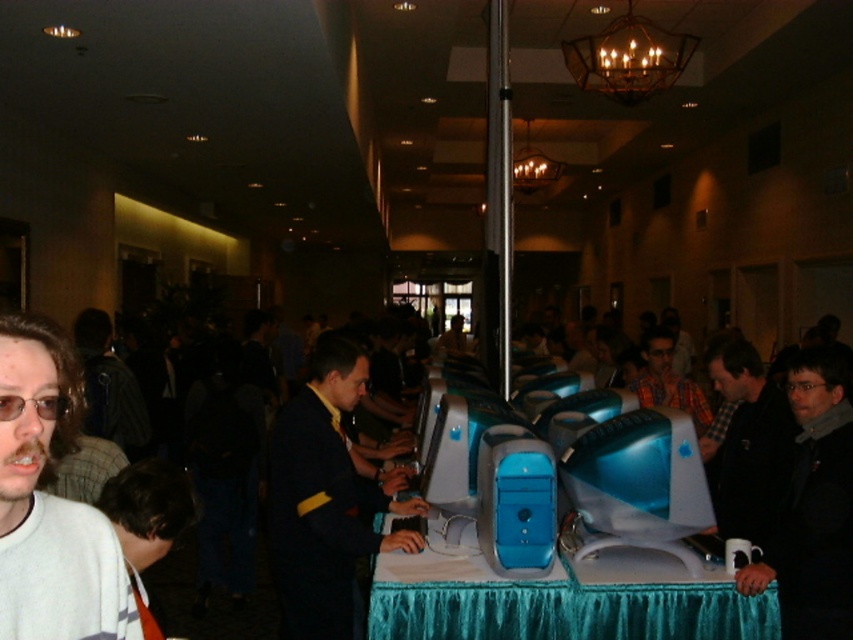
Question: Does blue glossy monitor at center lie in front of black wool sweater at right?

Choices:
 (A) yes
 (B) no

Answer: (B)

Question: Among these objects, which one is farthest from the camera?

Choices:
 (A) dark blue shirt at center
 (B) blue glossy monitor at center

Answer: (A)

Question: Does blue plastic monitor at center have a lesser width compared to dark blue suit at center?

Choices:
 (A) yes
 (B) no

Answer: (A)

Question: Which point is closer to the camera?

Choices:
 (A) plaid shirt at center
 (B) dark blue suit at center
 (C) teal fabric table at center

Answer: (C)

Question: Which point is farther to the camera?

Choices:
 (A) blue glossy monitor at center
 (B) plaid shirt at center
 (C) black wool sweater at right
 (D) white matte sweater at lower left

Answer: (B)

Question: Can you confirm if black wool sweater at right is positioned to the left of dark blue shirt at center?

Choices:
 (A) no
 (B) yes

Answer: (A)